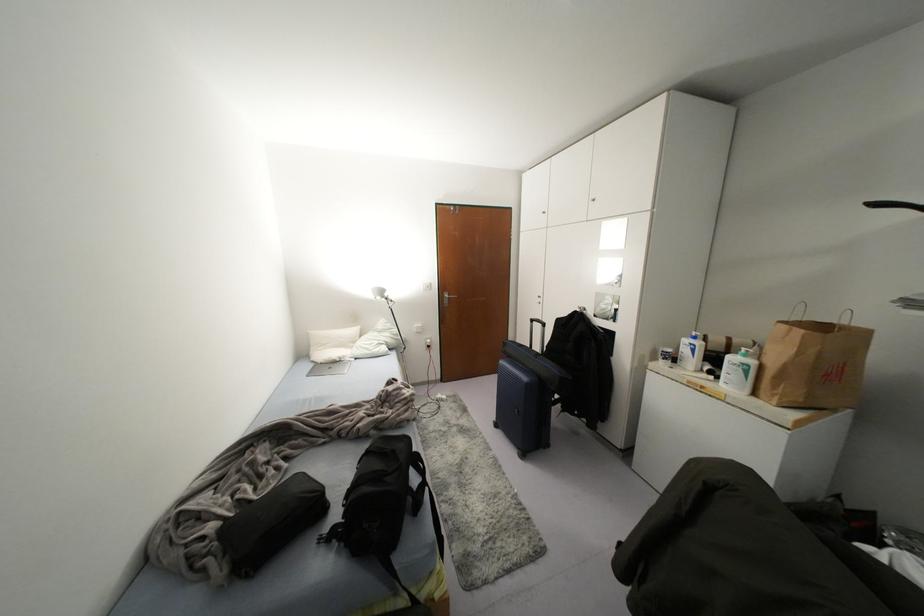
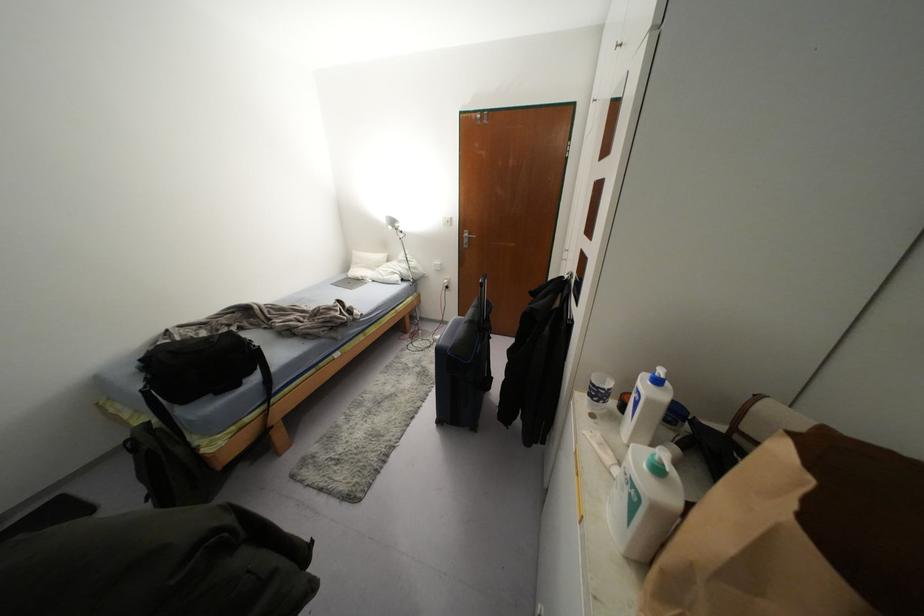
Locate, in the second image, the point that corresponds to (x=385, y=294) in the first image.

(395, 225)